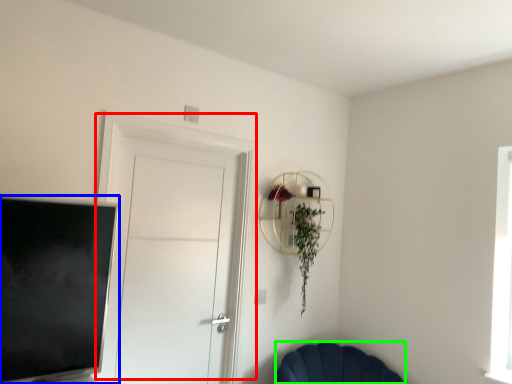
Question: Considering the real-world distances, which object is closest to door (highlighted by a red box)? television (highlighted by a blue box) or chair (highlighted by a green box).

Choices:
 (A) television
 (B) chair

Answer: (A)